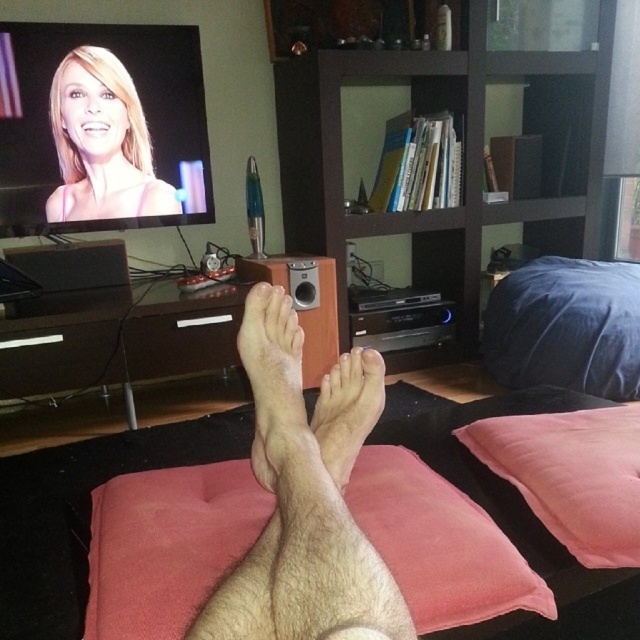
Question: Is brown wood entertainment center at center positioned in front of dry skin at center?

Choices:
 (A) no
 (B) yes

Answer: (A)

Question: Does hair-covered skin at center have a greater width compared to hairless skin at center?

Choices:
 (A) yes
 (B) no

Answer: (A)

Question: Based on their relative distances, which object is farther from the brown wood entertainment center at center?

Choices:
 (A) hair-covered skin at center
 (B) hairless skin at center
 (C) pink fabric pillow at lower right
 (D) blonde hair at upper left

Answer: (B)

Question: Considering the relative positions of hair-covered skin at center and blonde hair at upper left in the image provided, where is hair-covered skin at center located with respect to blonde hair at upper left?

Choices:
 (A) above
 (B) below

Answer: (B)

Question: Which is farther from the hairless skin at center?

Choices:
 (A) blonde hair at upper left
 (B) hair-covered skin at center

Answer: (A)

Question: Which point is farther to the camera?

Choices:
 (A) (368, 381)
 (B) (90, 88)

Answer: (B)